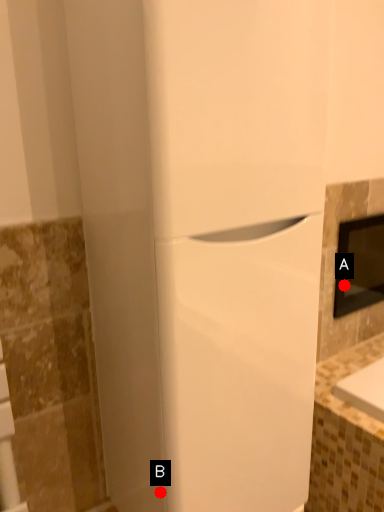
Question: Two points are circled on the image, labeled by A and B beside each circle. Which point appears closest to the camera in this image?

Choices:
 (A) A is closer
 (B) B is closer

Answer: (B)